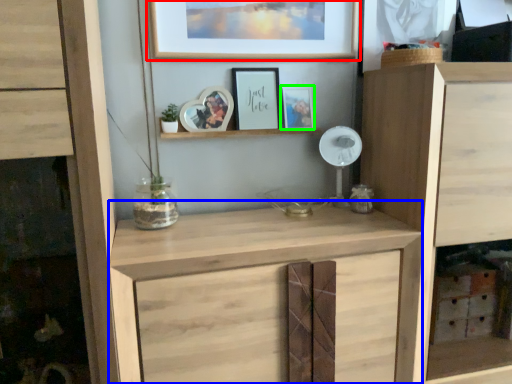
Question: Which object is the farthest from picture frame (highlighted by a red box)? Choose among these: cabinetry (highlighted by a blue box) or picture frame (highlighted by a green box).

Choices:
 (A) cabinetry
 (B) picture frame

Answer: (A)